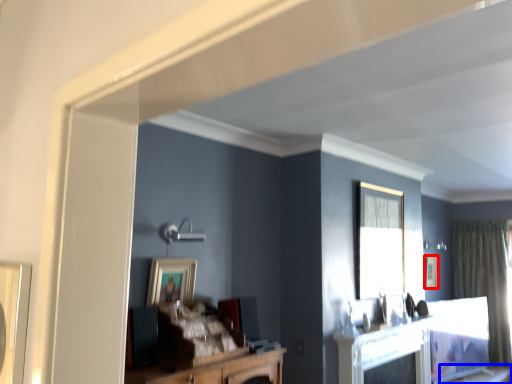
Question: Which object appears closest to the camera in this image, picture frame (highlighted by a red box) or table (highlighted by a blue box)?

Choices:
 (A) picture frame
 (B) table

Answer: (B)